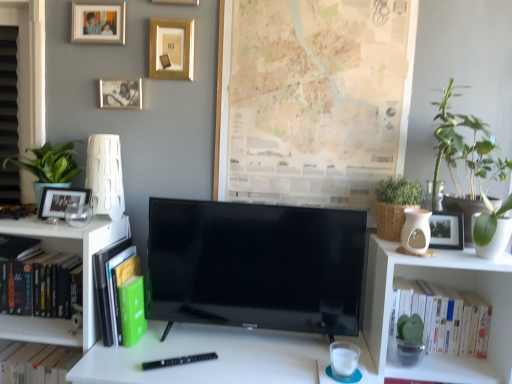
The width and height of the screenshot is (512, 384). I want to click on empty space that is ontop of white matte desk at center (from a real-world perspective), so [221, 352].